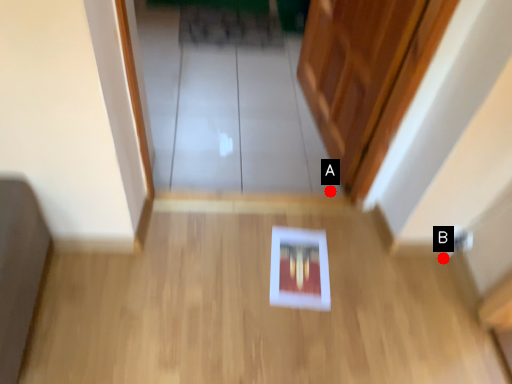
Question: Two points are circled on the image, labeled by A and B beside each circle. Which point appears closest to the camera in this image?

Choices:
 (A) A is closer
 (B) B is closer

Answer: (B)